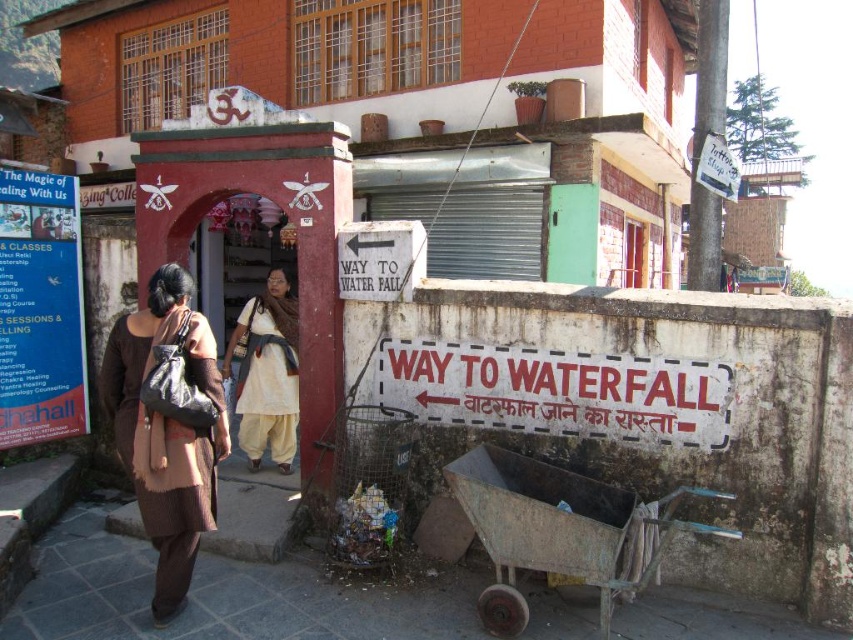
Question: Can you confirm if brown textured dress at left is smaller than rusty metal cart at lower center?

Choices:
 (A) yes
 (B) no

Answer: (A)

Question: Which point is farther from the camera taking this photo?

Choices:
 (A) pos(79,346)
 (B) pos(625,595)

Answer: (A)

Question: Which of the following is the farthest from the observer?

Choices:
 (A) (270, 301)
 (B) (624, 582)
 (C) (128, 388)
 (D) (24, 440)

Answer: (A)

Question: Based on their relative distances, which object is nearer to the blue paper sign at left?

Choices:
 (A) brown textured dress at left
 (B) white cotton dress at center

Answer: (B)

Question: Considering the relative positions of rusty metal cart at lower center and white cotton dress at center in the image provided, where is rusty metal cart at lower center located with respect to white cotton dress at center?

Choices:
 (A) below
 (B) above

Answer: (A)

Question: Does rusty metal cart at lower center have a greater width compared to white cotton dress at center?

Choices:
 (A) no
 (B) yes

Answer: (B)